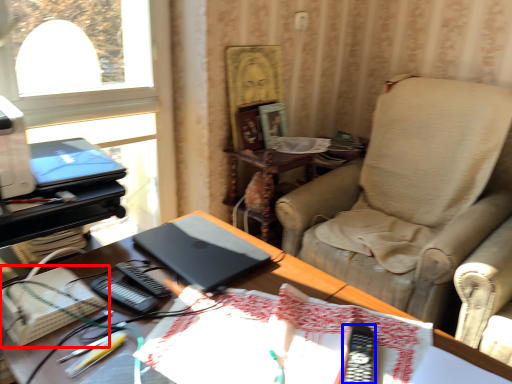
Question: Which point is closer to the camera, paperback book (highlighted by a red box) or equipment (highlighted by a blue box)?

Choices:
 (A) paperback book
 (B) equipment

Answer: (B)